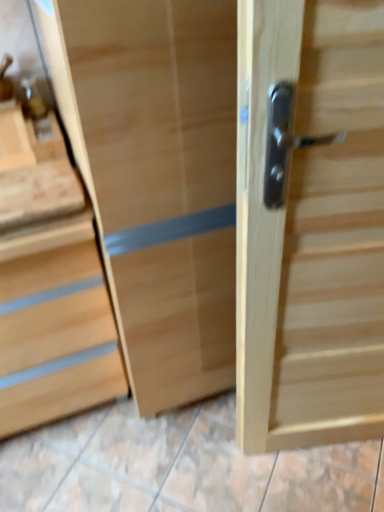
The image size is (384, 512). Describe the element at coordinates (309, 231) in the screenshot. I see `natural wood door handle at right` at that location.

Where is `natural wood door handle at right`? The image size is (384, 512). natural wood door handle at right is located at coordinates (309, 231).

The height and width of the screenshot is (512, 384). What do you see at coordinates (55, 324) in the screenshot?
I see `natural wood chest of drawers at left` at bounding box center [55, 324].

Locate an element on the screen. This screenshot has width=384, height=512. natural wood chest of drawers at left is located at coordinates (55, 324).

Locate an element on the screen. The width and height of the screenshot is (384, 512). natural wood door handle at right is located at coordinates (309, 231).

Can you confirm if natural wood door handle at right is positioned to the left of natural wood chest of drawers at left?

No, natural wood door handle at right is not to the left of natural wood chest of drawers at left.

Considering the relative positions of natural wood door handle at right and natural wood chest of drawers at left in the image provided, is natural wood door handle at right behind natural wood chest of drawers at left?

No, natural wood door handle at right is closer to the viewer.

Is point (253, 118) more distant than point (21, 350)?

No, (253, 118) is closer to viewer.

From the image's perspective, which one is positioned higher, natural wood door handle at right or natural wood chest of drawers at left?

natural wood door handle at right, from the image's perspective.

From a real-world perspective, is natural wood door handle at right physically located above or below natural wood chest of drawers at left?

natural wood door handle at right is situated higher than natural wood chest of drawers at left in the real world.

Which of these two, natural wood door handle at right or natural wood chest of drawers at left, is thinner?

natural wood door handle at right.

From their relative heights in the image, would you say natural wood door handle at right is taller or shorter than natural wood chest of drawers at left?

Considering their sizes, natural wood door handle at right has more height than natural wood chest of drawers at left.

Is natural wood door handle at right bigger than natural wood chest of drawers at left?

Actually, natural wood door handle at right might be smaller than natural wood chest of drawers at left.

Can natural wood chest of drawers at left be found inside natural wood door handle at right?

Actually, natural wood chest of drawers at left is outside natural wood door handle at right.

Is natural wood door handle at right far from natural wood chest of drawers at left?

No, there isn't a large distance between natural wood door handle at right and natural wood chest of drawers at left.

From the picture: Is natural wood door handle at right turned away from natural wood chest of drawers at left?

That's not correct — natural wood door handle at right is not looking away from natural wood chest of drawers at left.

Based on the photo, can you tell me how much natural wood door handle at right and natural wood chest of drawers at left differ in facing direction?

The angle between the facing direction of natural wood door handle at right and the facing direction of natural wood chest of drawers at left is 15.7 degrees.

The image size is (384, 512). I want to click on door above the natural wood chest of drawers at left (from a real-world perspective), so click(x=309, y=231).

Based on their positions, is natural wood chest of drawers at left located to the left or right of natural wood door handle at right?

Based on their positions, natural wood chest of drawers at left is located to the left of natural wood door handle at right.

Is natural wood chest of drawers at left further to the viewer compared to natural wood door handle at right?

Yes, the depth of natural wood chest of drawers at left is greater than that of natural wood door handle at right.

Does point (35, 423) come closer to viewer compared to point (265, 159)?

No, it is behind (265, 159).

From the image's perspective, is natural wood chest of drawers at left over natural wood door handle at right?

No, from the image's perspective, natural wood chest of drawers at left is not on top of natural wood door handle at right.

From a real-world perspective, is natural wood chest of drawers at left under natural wood door handle at right?

Yes, from a real-world perspective, natural wood chest of drawers at left is beneath natural wood door handle at right.

Which of these two, natural wood chest of drawers at left or natural wood door handle at right, is wider?

natural wood chest of drawers at left is wider.

Consider the image. In terms of height, does natural wood chest of drawers at left look taller or shorter compared to natural wood door handle at right?

In the image, natural wood chest of drawers at left appears to be shorter than natural wood door handle at right.

Who is smaller, natural wood chest of drawers at left or natural wood door handle at right?

Smaller between the two is natural wood door handle at right.

Which is correct: natural wood chest of drawers at left is inside natural wood door handle at right, or outside of it?

natural wood chest of drawers at left lies outside natural wood door handle at right.

Are natural wood chest of drawers at left and natural wood door handle at right making contact?

There is a gap between natural wood chest of drawers at left and natural wood door handle at right.

Could you tell me if natural wood chest of drawers at left is facing natural wood door handle at right?

No, natural wood chest of drawers at left is not facing towards natural wood door handle at right.

What's the angular difference between natural wood chest of drawers at left and natural wood door handle at right's facing directions?

15.7 degrees.

In the image, there is a natural wood door handle at right. Where is `the chest of drawers below it (from the image's perspective)`? Image resolution: width=384 pixels, height=512 pixels. the chest of drawers below it (from the image's perspective) is located at coordinates (55, 324).

This screenshot has height=512, width=384. I want to click on door above the natural wood chest of drawers at left (from a real-world perspective), so click(x=309, y=231).

In the image, there is a natural wood door handle at right. Where is `the chest of drawers below it (from a real-world perspective)`? Image resolution: width=384 pixels, height=512 pixels. the chest of drawers below it (from a real-world perspective) is located at coordinates (55, 324).